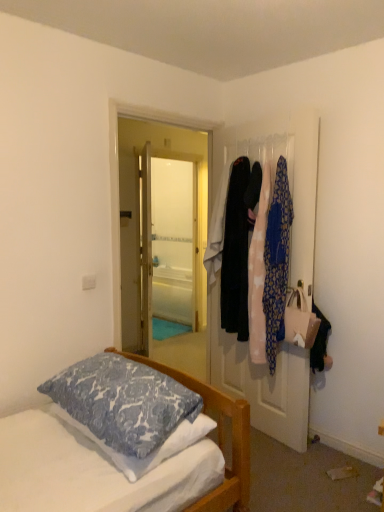
What are the coordinates of `free location in front of white glossy door at center` in the screenshot? It's located at (291, 475).